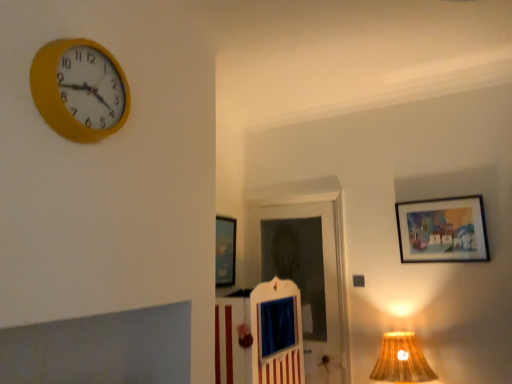
Question: From a real-world perspective, is yellow plastic wall clock at upper left positioned over metallic silver picture frame at center, which ranks as the 1th picture frame in back-to-front order, based on gravity?

Choices:
 (A) no
 (B) yes

Answer: (B)

Question: Is yellow plastic wall clock at upper left to the left of metallic silver picture frame at center, arranged as the second picture frame when viewed from the right, from the viewer's perspective?

Choices:
 (A) no
 (B) yes

Answer: (B)

Question: Does yellow plastic wall clock at upper left have a smaller size compared to metallic silver picture frame at center, which is counted as the first picture frame, starting from the left?

Choices:
 (A) yes
 (B) no

Answer: (B)

Question: Would you say yellow plastic wall clock at upper left is outside metallic silver picture frame at center, which ranks as the 1th picture frame in back-to-front order?

Choices:
 (A) no
 (B) yes

Answer: (B)

Question: Is yellow plastic wall clock at upper left taller than metallic silver picture frame at center, which is counted as the first picture frame, starting from the left?

Choices:
 (A) yes
 (B) no

Answer: (B)

Question: From a real-world perspective, relative to white wooden door at center, is yellow plastic wall clock at upper left vertically above or below?

Choices:
 (A) above
 (B) below

Answer: (A)

Question: In terms of size, does yellow plastic wall clock at upper left appear bigger or smaller than white wooden door at center?

Choices:
 (A) small
 (B) big

Answer: (A)

Question: Does point (76, 46) appear closer or farther from the camera than point (308, 340)?

Choices:
 (A) closer
 (B) farther

Answer: (A)

Question: Based on their positions, is yellow plastic wall clock at upper left located to the left or right of white wooden door at center?

Choices:
 (A) right
 (B) left

Answer: (B)

Question: Is matte wooden picture frame at upper right, which is counted as the 1th picture frame, starting from the front, in front of or behind braided fabric lampshade at lower right in the image?

Choices:
 (A) front
 (B) behind

Answer: (B)

Question: From the image's perspective, is matte wooden picture frame at upper right, positioned as the 1th picture frame in right-to-left order, located above or below braided fabric lampshade at lower right?

Choices:
 (A) above
 (B) below

Answer: (A)

Question: Is matte wooden picture frame at upper right, positioned as the 1th picture frame in right-to-left order, wider or thinner than braided fabric lampshade at lower right?

Choices:
 (A) thin
 (B) wide

Answer: (A)

Question: From a real-world perspective, is matte wooden picture frame at upper right, the second picture frame when ordered from left to right, physically located above or below braided fabric lampshade at lower right?

Choices:
 (A) below
 (B) above

Answer: (B)

Question: In terms of height, does metallic silver picture frame at center, the 2th picture frame in the front-to-back sequence, look taller or shorter compared to matte wooden picture frame at upper right, arranged as the 2th picture frame when viewed from the back?

Choices:
 (A) tall
 (B) short

Answer: (A)

Question: In terms of width, does metallic silver picture frame at center, which ranks as the 1th picture frame in back-to-front order, look wider or thinner when compared to matte wooden picture frame at upper right, which is counted as the 1th picture frame, starting from the front?

Choices:
 (A) thin
 (B) wide

Answer: (B)